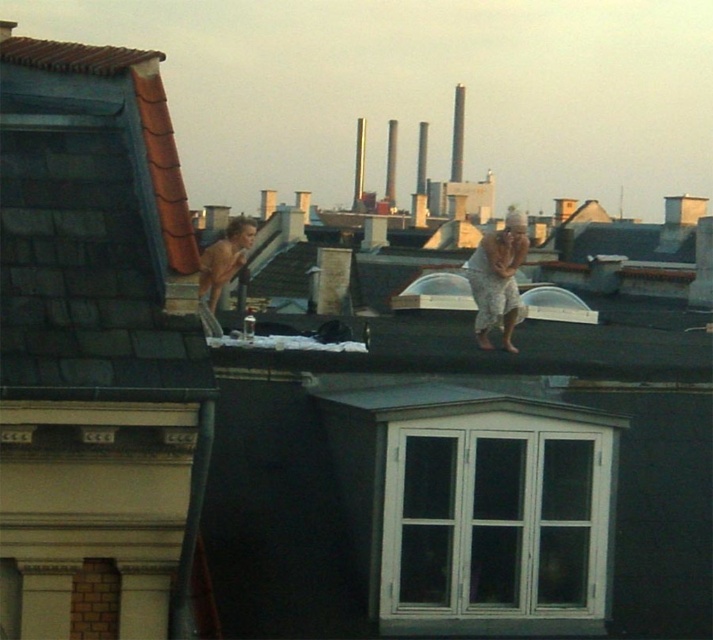
Who is taller, gray textured pants at center or shiny skin at center?

With more height is shiny skin at center.

Who is more forward, (488,243) or (220,284)?

Point (220,284) is more forward.

In order to click on gray textured pants at center in this screenshot , I will do `click(497, 280)`.